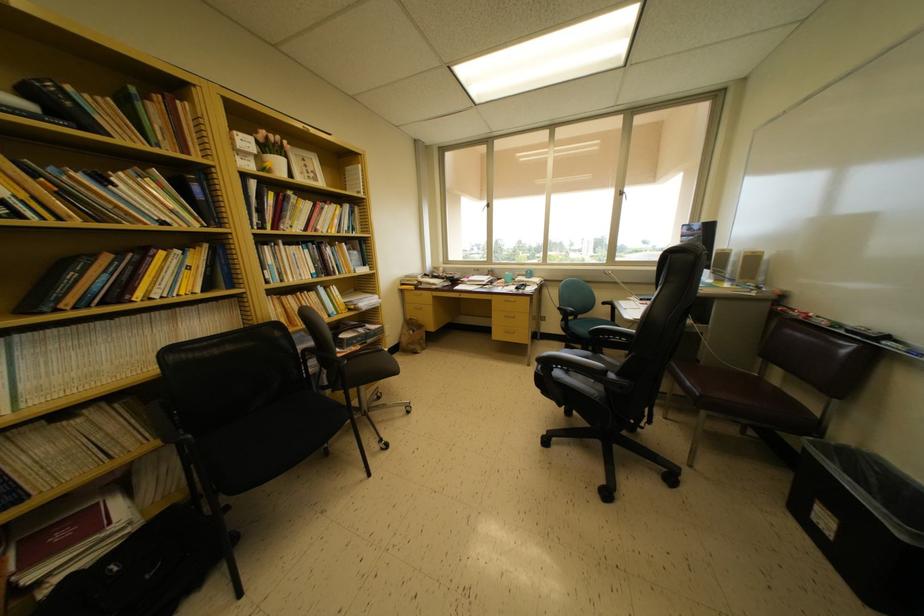
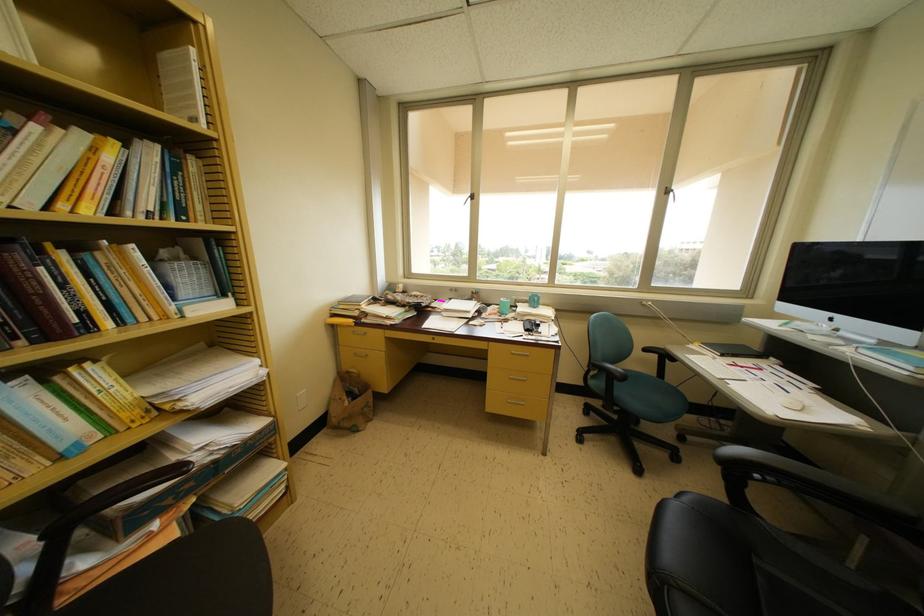
Where in the second image is the point corresponding to point 573,315 from the first image?

(622, 379)